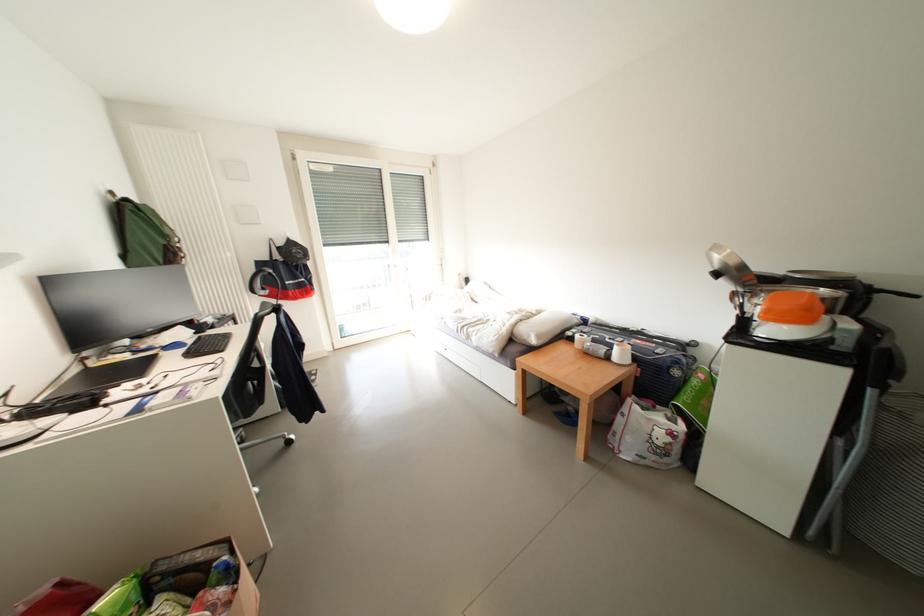
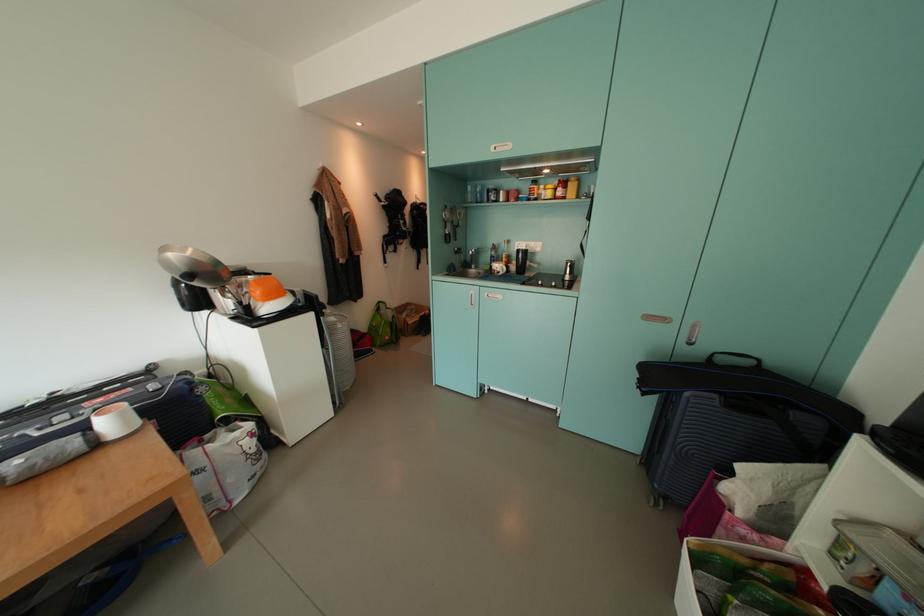
Locate, in the second image, the point that corresponds to (628,358) in the first image.

(123, 426)